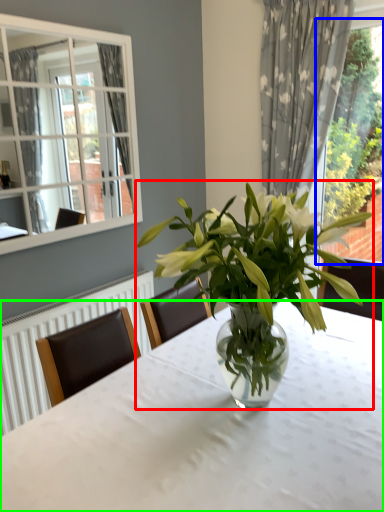
Question: Which object is the farthest from houseplant (highlighted by a red box)? Choose among these: bay window (highlighted by a blue box) or table (highlighted by a green box).

Choices:
 (A) bay window
 (B) table

Answer: (A)